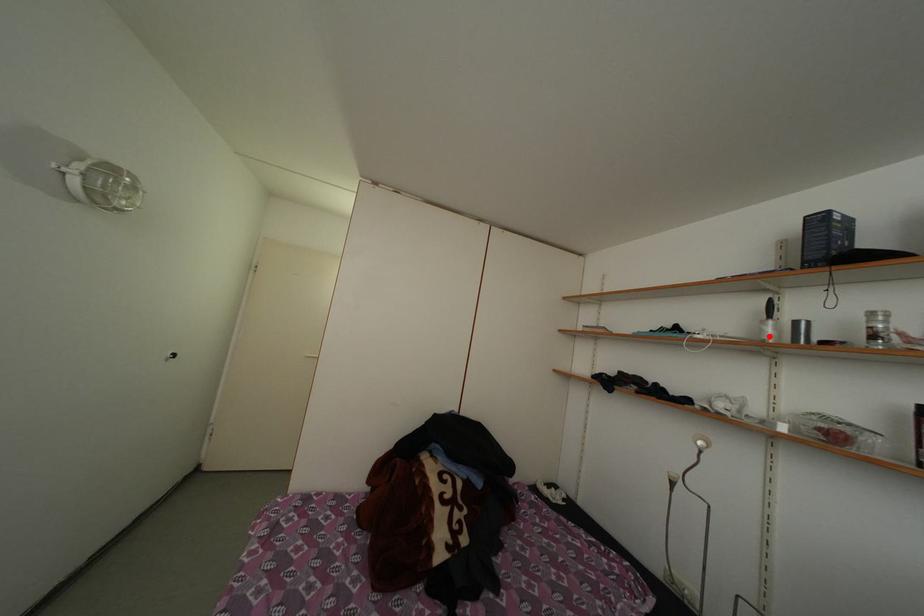
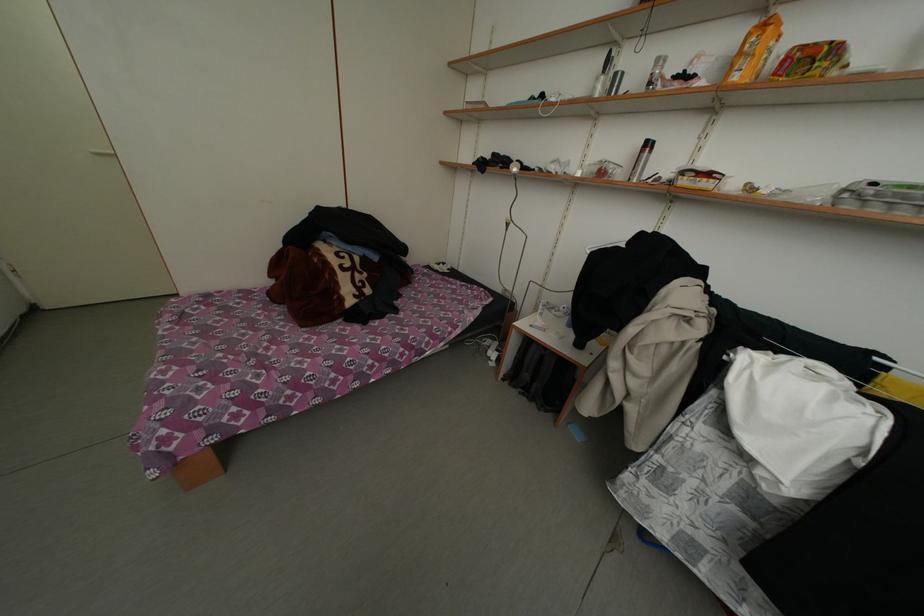
Where in the second image is the point corresponding to the highlighted location from the first image?

(602, 94)